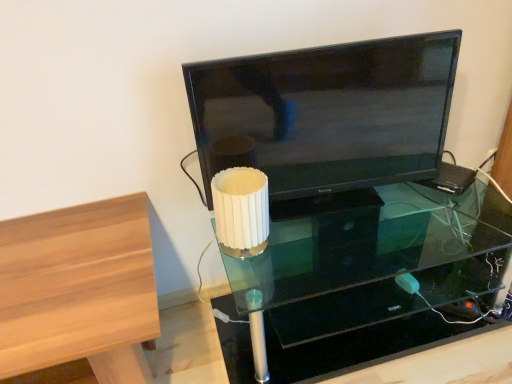
At what (x,y) coordinates should I click in order to perform the action: click on empty space that is ontop of light brown wood table at left (from a real-world perspective). Please return your answer as a coordinate pair (x, y). The height and width of the screenshot is (384, 512). Looking at the image, I should click on (68, 263).